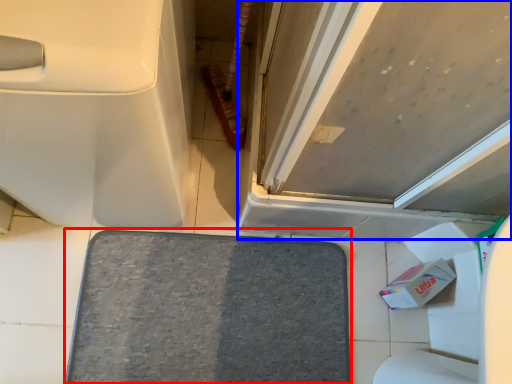
Question: Which point is further to the camera, bath mat (highlighted by a red box) or door (highlighted by a blue box)?

Choices:
 (A) bath mat
 (B) door

Answer: (A)